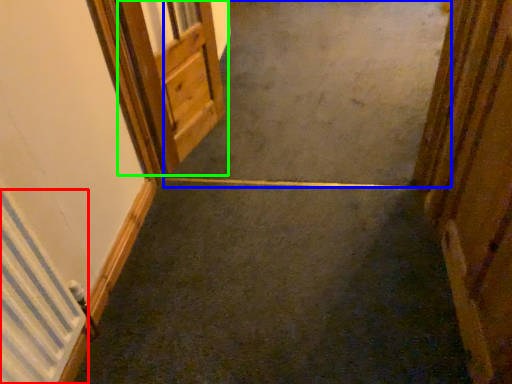
Question: Based on their relative distances, which object is farther from radiator (highlighted by a red box)? Choose from concrete (highlighted by a blue box) and door (highlighted by a green box).

Choices:
 (A) concrete
 (B) door

Answer: (A)